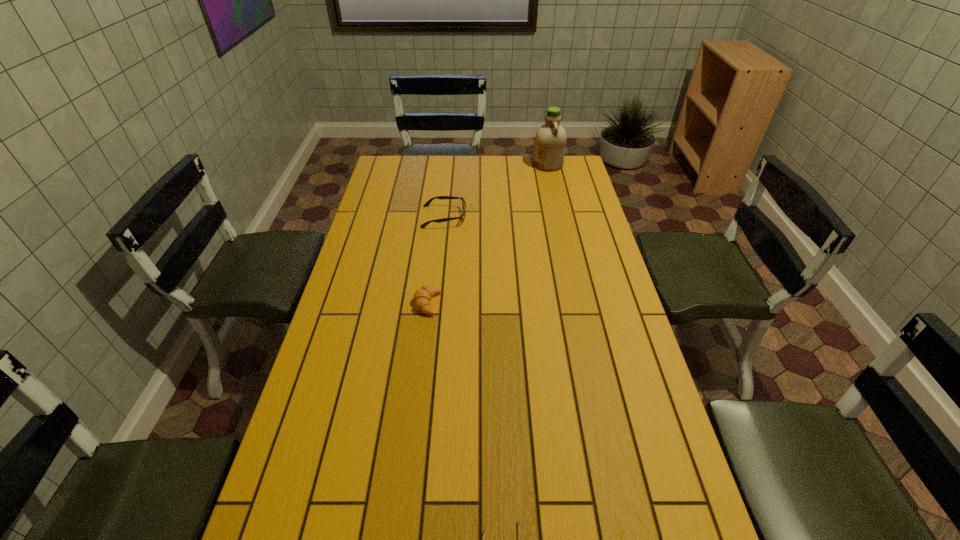
This screenshot has width=960, height=540. I want to click on cleansing agent, so click(x=550, y=141).

This screenshot has height=540, width=960. What are the coordinates of `the tallest object` in the screenshot? It's located at (550, 141).

Image resolution: width=960 pixels, height=540 pixels. In order to click on the third nearest object in this screenshot , I will do `click(428, 202)`.

Where is `the second nearest object`? the second nearest object is located at coordinates (422, 297).

The height and width of the screenshot is (540, 960). Find the location of `free region located on the front label of the cleansing agent`. free region located on the front label of the cleansing agent is located at coordinates (469, 165).

You are a GUI agent. You are given a task and a screenshot of the screen. Output one action in this format:
    pyautogui.click(x=<x>, y=<y>)
    Task: Click on the free space located on the front label of the cleansing agent
    The width and height of the screenshot is (960, 540).
    Given the screenshot: What is the action you would take?
    pyautogui.click(x=476, y=165)

Where is `vacant space located on the front label of the cleansing agent`? vacant space located on the front label of the cleansing agent is located at coordinates (454, 165).

Image resolution: width=960 pixels, height=540 pixels. What are the coordinates of `vacant space located on the front-facing side of the spectacles` in the screenshot? It's located at (556, 217).

Where is `free space located 0.070m on the right of the third farthest object`? This screenshot has width=960, height=540. free space located 0.070m on the right of the third farthest object is located at coordinates (464, 304).

This screenshot has height=540, width=960. I want to click on object that is positioned at the far edge, so click(x=550, y=141).